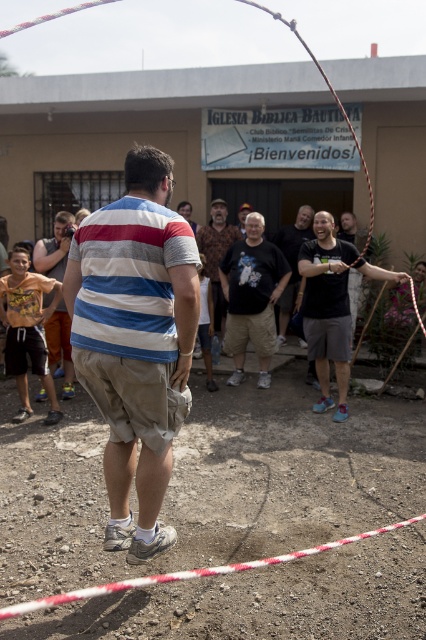
Does point (68, 380) come in front of point (186, 218)?

Yes, it is.

Is the position of yellow t-shirt at center less distant than that of matte striped shirt at center?

Yes, yellow t-shirt at center is closer to the viewer.

Is point (72, 392) closer to camera compared to point (187, 200)?

Yes, it is in front of point (187, 200).

This screenshot has height=640, width=426. What are the coordinates of `yellow t-shirt at center` in the screenshot? It's located at (54, 248).

Is point (321, 348) in front of point (276, 257)?

That is True.

Is the position of black matte shirt at center less distant than that of black cotton t-shirt at center?

Yes, black matte shirt at center is closer to the viewer.

In order to click on black matte shirt at center in this screenshot , I will do `click(331, 305)`.

Identify the location of black matte shirt at center. Image resolution: width=426 pixels, height=640 pixels. (331, 305).

Is point (112, 387) farther from viewer compared to point (344, 115)?

No, it is not.

Between point (166, 392) and point (287, 22), which one is positioned behind?

Positioned behind is point (287, 22).

Locate an element on the screen. This screenshot has height=640, width=426. striped cotton shirt at center is located at coordinates (135, 340).